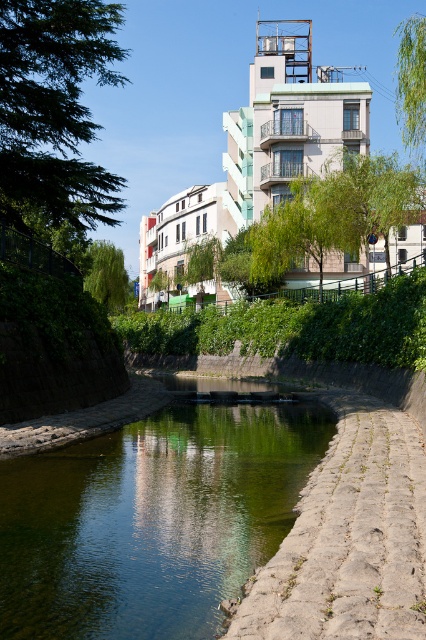
Can you confirm if stone textured path at lower right is taller than green leafy tree at upper right?

No, stone textured path at lower right is not taller than green leafy tree at upper right.

Which is in front, point (331, 401) or point (416, 90)?

Point (331, 401)

Locate an element on the screen. The height and width of the screenshot is (640, 426). stone textured path at lower right is located at coordinates (348, 538).

Can you confirm if green smooth water at center is shorter than stone textured path at lower right?

No, green smooth water at center is not shorter than stone textured path at lower right.

Which is more to the right, green smooth water at center or stone textured path at lower right?

From the viewer's perspective, stone textured path at lower right appears more on the right side.

Between point (296, 428) and point (383, 508), which one is positioned behind?

The point (296, 428) is behind.

Identify the location of green smooth water at center. Image resolution: width=426 pixels, height=640 pixels. (152, 520).

Who is more forward, (74, 624) or (118, 301)?

Point (74, 624)

Describe the element at coordinates (152, 520) in the screenshot. This screenshot has height=640, width=426. I see `green smooth water at center` at that location.

Is point (3, 518) closer to camera compared to point (109, 257)?

Yes, point (3, 518) is in front of point (109, 257).

Locate an element on the screen. This screenshot has width=426, height=640. green smooth water at center is located at coordinates [x=152, y=520].